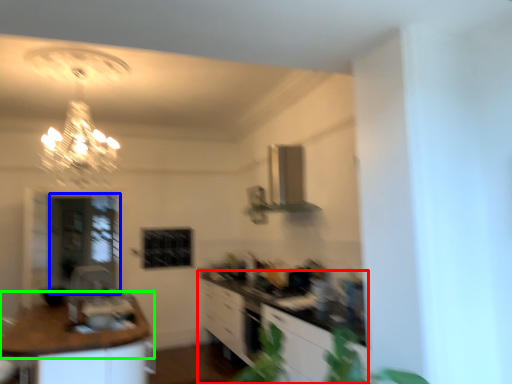
Question: Which is nearer to the cabinetry (highlighted by a red box)? glass door (highlighted by a blue box) or countertop (highlighted by a green box).

Choices:
 (A) glass door
 (B) countertop

Answer: (B)